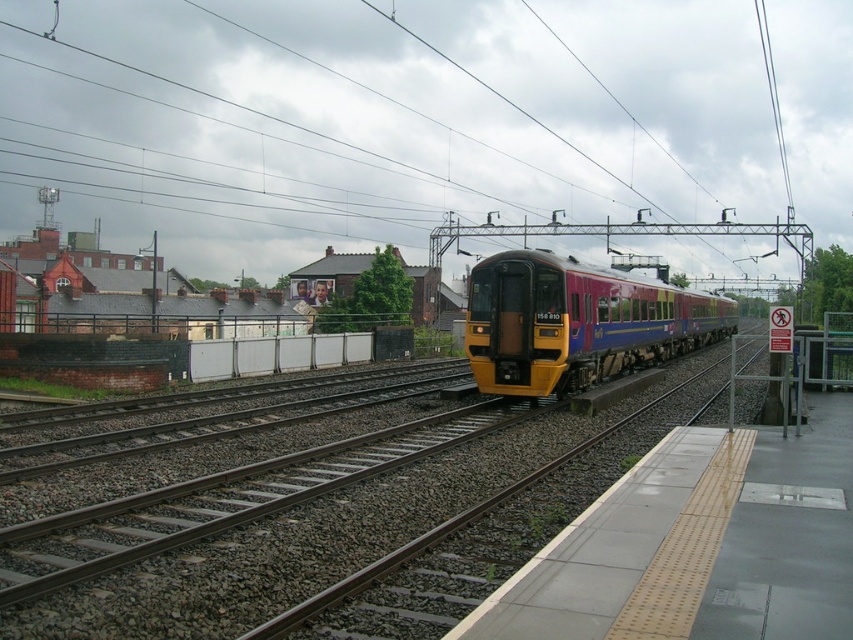
You are a passenger waiting on the platform and see the metallic wires at upper center and the yellow metallic train at center. Which object is positioned higher from the ground?

The metallic wires at upper center are positioned higher from the ground than the yellow metallic train at center because they are located above it.

Based on the photo, you are a photographer standing on the platform and want to capture both the metallic wires at upper center and the yellow metallic train at center in a single shot. Which object will appear larger in your photo?

The metallic wires at upper center will appear larger in the photo because they are larger in size than the yellow metallic train at center according to the description.

You are a passenger waiting at the station platform. You notice metallic wires at upper center and a yellow metallic train at center. Which object is closer to you, the passenger?

The metallic wires at upper center are closer to you because the yellow metallic train at center is behind them.